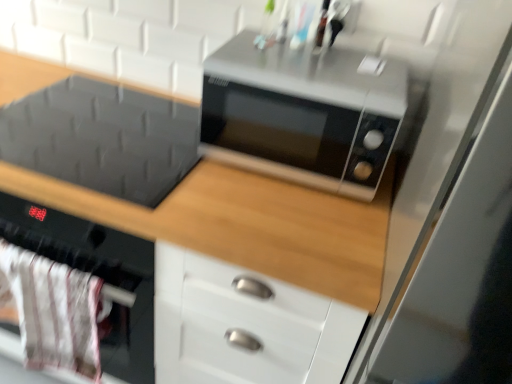
Question: Considering the relative positions of matte black microwave at upper center and white fabric oven at lower left in the image provided, is matte black microwave at upper center behind white fabric oven at lower left?

Choices:
 (A) no
 (B) yes

Answer: (A)

Question: Is matte black microwave at upper center touching white fabric oven at lower left?

Choices:
 (A) yes
 (B) no

Answer: (B)

Question: From a real-world perspective, is matte black microwave at upper center under white fabric oven at lower left?

Choices:
 (A) no
 (B) yes

Answer: (B)

Question: From a real-world perspective, is matte black microwave at upper center physically above white fabric oven at lower left?

Choices:
 (A) no
 (B) yes

Answer: (A)

Question: From the image's perspective, is matte black microwave at upper center on white fabric oven at lower left?

Choices:
 (A) no
 (B) yes

Answer: (B)

Question: Is matte black microwave at upper center at the left side of white fabric oven at lower left?

Choices:
 (A) yes
 (B) no

Answer: (B)

Question: Can you see matte black microwave at upper center touching transparent glass door at right?

Choices:
 (A) yes
 (B) no

Answer: (B)

Question: From a real-world perspective, is matte black microwave at upper center on top of transparent glass door at right?

Choices:
 (A) yes
 (B) no

Answer: (B)

Question: Is matte black microwave at upper center at the left side of transparent glass door at right?

Choices:
 (A) yes
 (B) no

Answer: (A)

Question: Does matte black microwave at upper center come in front of transparent glass door at right?

Choices:
 (A) no
 (B) yes

Answer: (A)

Question: Considering the relative sizes of matte black microwave at upper center and transparent glass door at right in the image provided, is matte black microwave at upper center bigger than transparent glass door at right?

Choices:
 (A) no
 (B) yes

Answer: (B)

Question: From the image's perspective, is matte black microwave at upper center on transparent glass door at right?

Choices:
 (A) no
 (B) yes

Answer: (B)

Question: Is transparent glass door at right to the left of matte black microwave at upper center from the viewer's perspective?

Choices:
 (A) no
 (B) yes

Answer: (A)